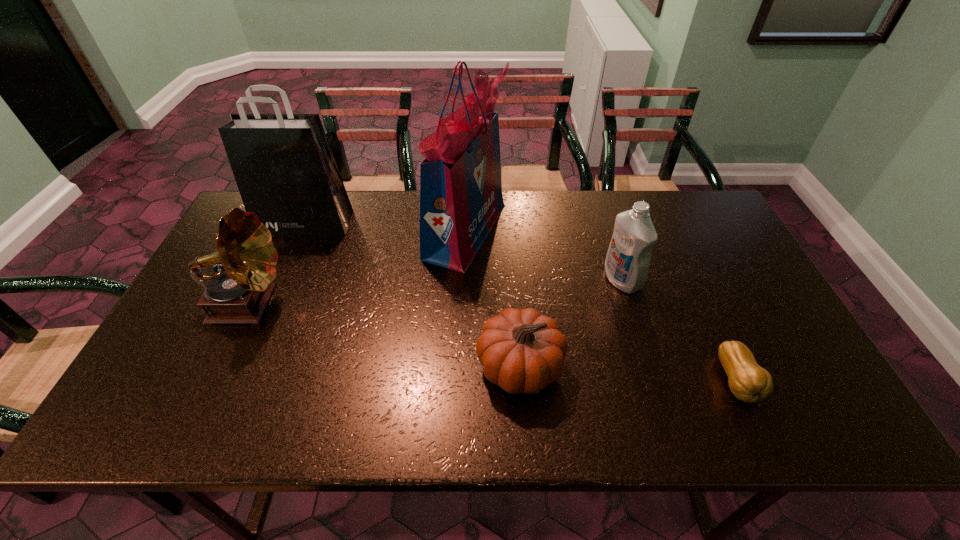
You are a GUI agent. You are given a task and a screenshot of the screen. Output one action in this format:
    pyautogui.click(x=<x>, y=<y>)
    Task: Click on the unoccupied position between the detergent and the tallest object
    The width and height of the screenshot is (960, 540).
    Given the screenshot: What is the action you would take?
    pyautogui.click(x=543, y=255)

Where is `free space between the detergent and the gourd`? This screenshot has height=540, width=960. free space between the detergent and the gourd is located at coordinates (680, 331).

In order to click on blank region between the second object from right to left and the tallest object in this screenshot , I will do `click(543, 255)`.

Find the location of `free space that is in between the second shortest object and the phonograph_record`. free space that is in between the second shortest object and the phonograph_record is located at coordinates [x=384, y=335].

The height and width of the screenshot is (540, 960). I want to click on vacant point located between the rightmost object and the fifth shortest object, so click(x=521, y=302).

This screenshot has width=960, height=540. I want to click on blank region between the shopping bag and the second shortest object, so [x=413, y=294].

Select which object is the third closest to the second tallest object. Please provide its 2D coordinates. Your answer should be formatted as a tuple, i.e. [(x, y)], where the tuple contains the x and y coordinates of a point satisfying the conditions above.

[(522, 351)]

Point out which object is positioned as the third nearest to the shortest object. Please provide its 2D coordinates. Your answer should be formatted as a tuple, i.e. [(x, y)], where the tuple contains the x and y coordinates of a point satisfying the conditions above.

[(461, 198)]

Identify the location of vacant space that satisfies the following two spatial constraints: 1. on the front-facing side of the tallest object; 2. on the back side of the detergent. The width and height of the screenshot is (960, 540). (464, 280).

Locate an element on the screen. This screenshot has height=540, width=960. free space that satisfies the following two spatial constraints: 1. on the front with handles of the shopping bag; 2. on the horn of the phonograph_record is located at coordinates (270, 304).